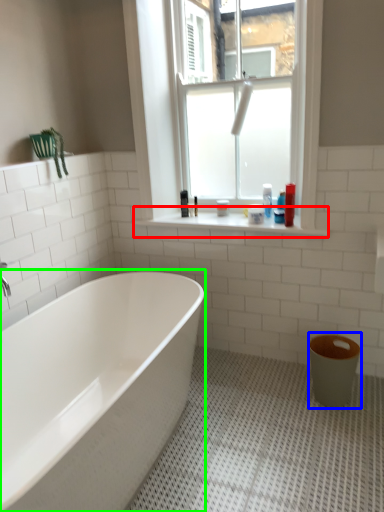
Question: Estimate the real-world distances between objects in this image. Which object is closer to window sill (highlighted by a red box), toilet bowl (highlighted by a blue box) or bathtub (highlighted by a green box)?

Choices:
 (A) toilet bowl
 (B) bathtub

Answer: (A)